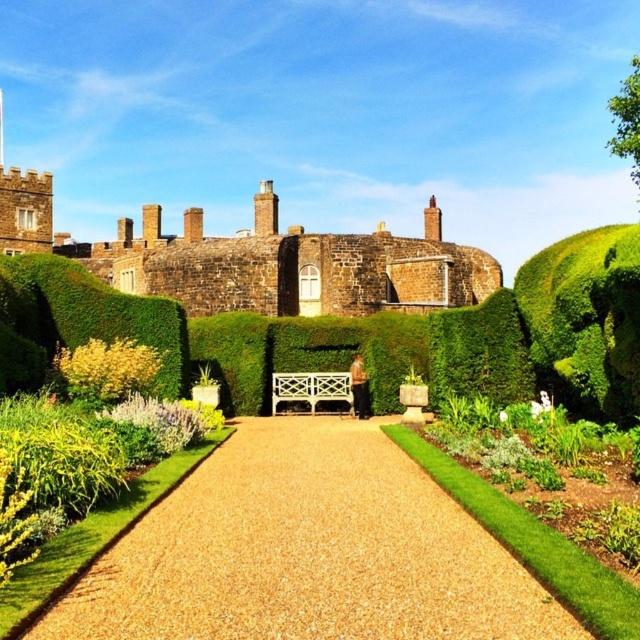
Between gravel path at center and brown stone castle at upper center, which one appears on the left side from the viewer's perspective?

From the viewer's perspective, brown stone castle at upper center appears more on the left side.

Is point (317, 480) more distant than point (381, 291)?

That is False.

The height and width of the screenshot is (640, 640). I want to click on gravel path at center, so click(314, 552).

Which of these two, brown stone castle at upper center or green leafy bush at center, stands shorter?

With less height is green leafy bush at center.

Who is more distant from viewer, [330,252] or [496,300]?

The point [330,252] is more distant.

The height and width of the screenshot is (640, 640). I want to click on brown stone castle at upper center, so click(257, 259).

Can you confirm if gravel path at center is taller than green leafy bush at center?

No.

Is point (180, 608) positioned behind point (500, 310)?

No, (180, 608) is in front of (500, 310).

Locate an element on the screen. The width and height of the screenshot is (640, 640). gravel path at center is located at coordinates click(314, 552).